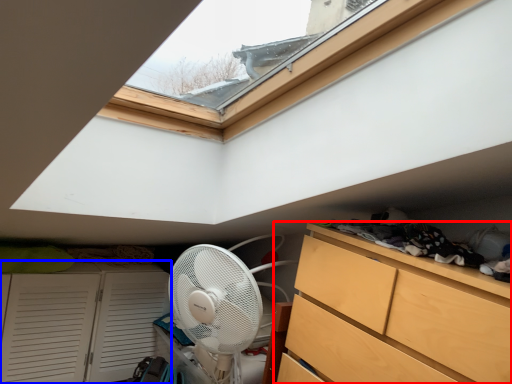
Question: Which object appears farthest to the camera in this image, chest of drawers (highlighted by a red box) or cupboard (highlighted by a blue box)?

Choices:
 (A) chest of drawers
 (B) cupboard

Answer: (B)